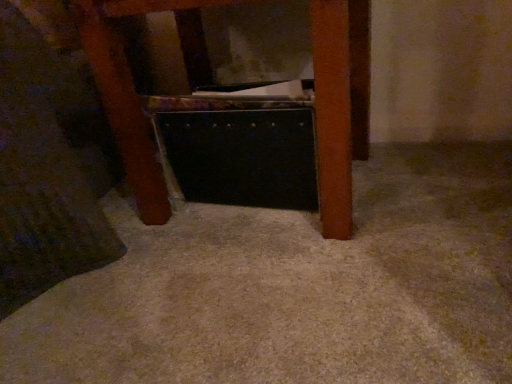
Question: Is metallic black briefcase at center a part of black plastic drawer at center?

Choices:
 (A) yes
 (B) no

Answer: (B)

Question: Could you tell me if black plastic drawer at center is turned towards metallic black briefcase at center?

Choices:
 (A) no
 (B) yes

Answer: (B)

Question: Can you confirm if black plastic drawer at center is positioned to the left of metallic black briefcase at center?

Choices:
 (A) no
 (B) yes

Answer: (A)

Question: Is black plastic drawer at center in front of metallic black briefcase at center?

Choices:
 (A) yes
 (B) no

Answer: (B)

Question: Can you confirm if black plastic drawer at center is positioned to the right of metallic black briefcase at center?

Choices:
 (A) no
 (B) yes

Answer: (B)

Question: Is black plastic drawer at center positioned far away from metallic black briefcase at center?

Choices:
 (A) yes
 (B) no

Answer: (B)

Question: Are metallic black briefcase at center and black plastic drawer at center far apart?

Choices:
 (A) no
 (B) yes

Answer: (A)

Question: Is metallic black briefcase at center oriented towards black plastic drawer at center?

Choices:
 (A) yes
 (B) no

Answer: (A)

Question: Does metallic black briefcase at center have a greater height compared to black plastic drawer at center?

Choices:
 (A) no
 (B) yes

Answer: (B)

Question: From a real-world perspective, is metallic black briefcase at center located higher than black plastic drawer at center?

Choices:
 (A) yes
 (B) no

Answer: (A)

Question: Is metallic black briefcase at center closer to the viewer compared to black plastic drawer at center?

Choices:
 (A) no
 (B) yes

Answer: (B)

Question: From a real-world perspective, is metallic black briefcase at center beneath black plastic drawer at center?

Choices:
 (A) no
 (B) yes

Answer: (A)

Question: Is point (345, 182) closer or farther from the camera than point (285, 137)?

Choices:
 (A) farther
 (B) closer

Answer: (B)